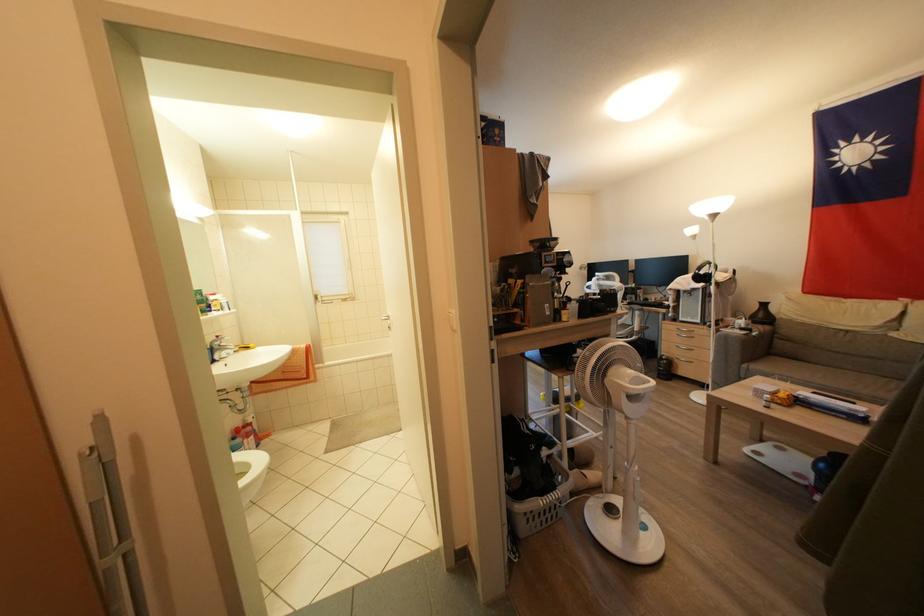
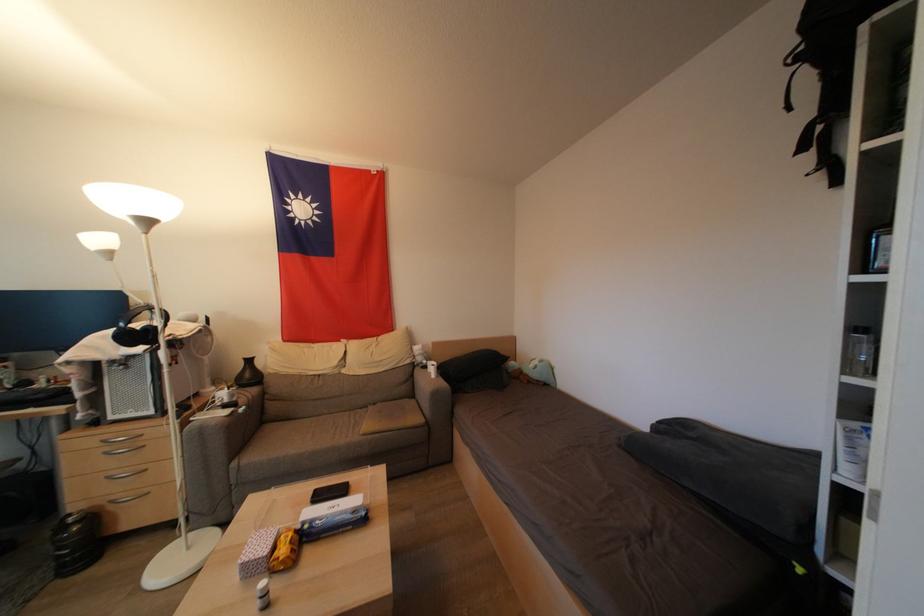
Locate, in the second image, the point that corresponds to (707,282) in the first image.

(142, 339)